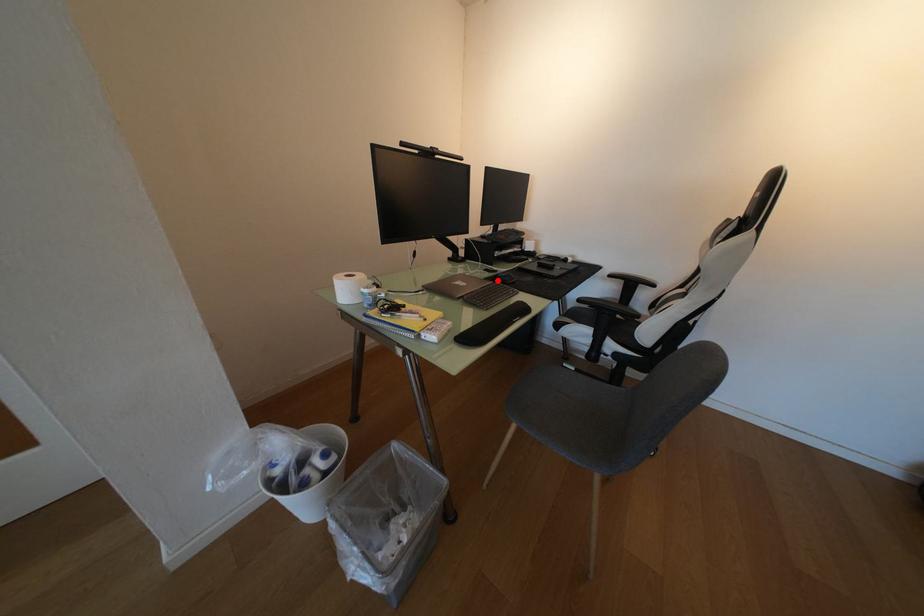
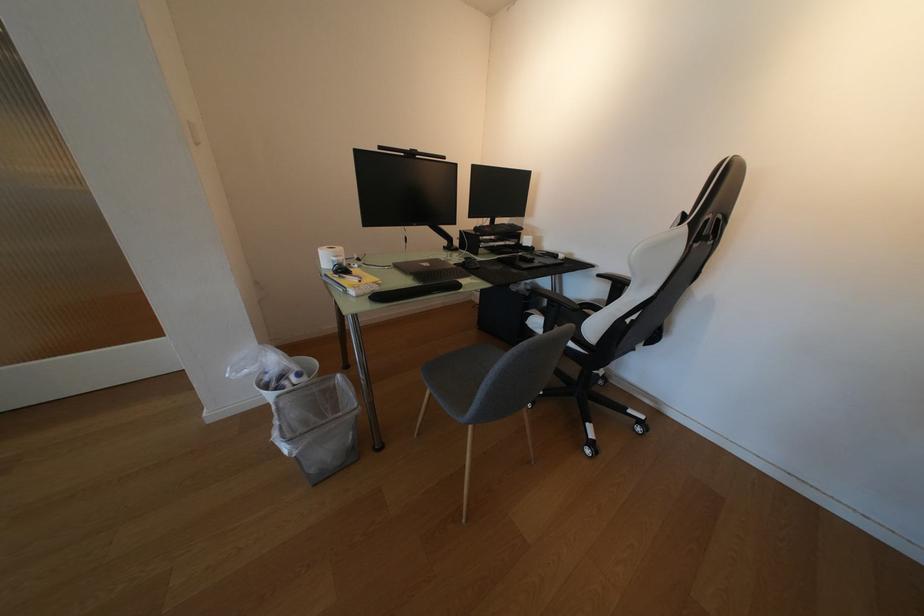
Locate, in the second image, the point that corresponds to the highlighted location in the first image.

(466, 265)